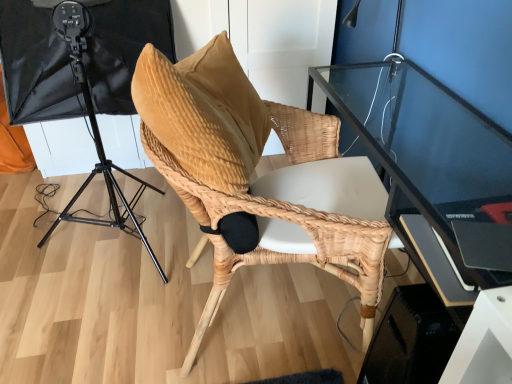
The image size is (512, 384). In order to click on vacant region under black matte tripod at left (from a real-world perspective) in this screenshot , I will do `click(119, 232)`.